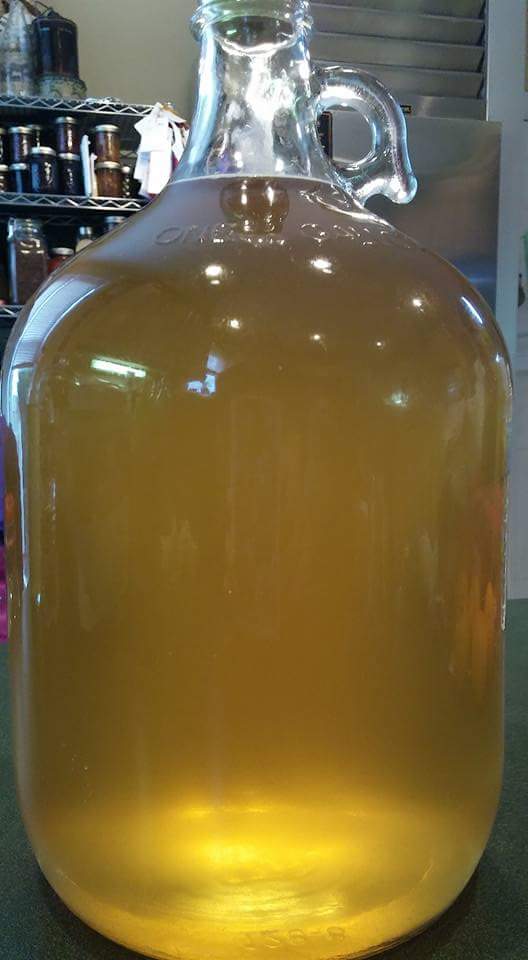
Identify the location of glass jug. (247, 379).